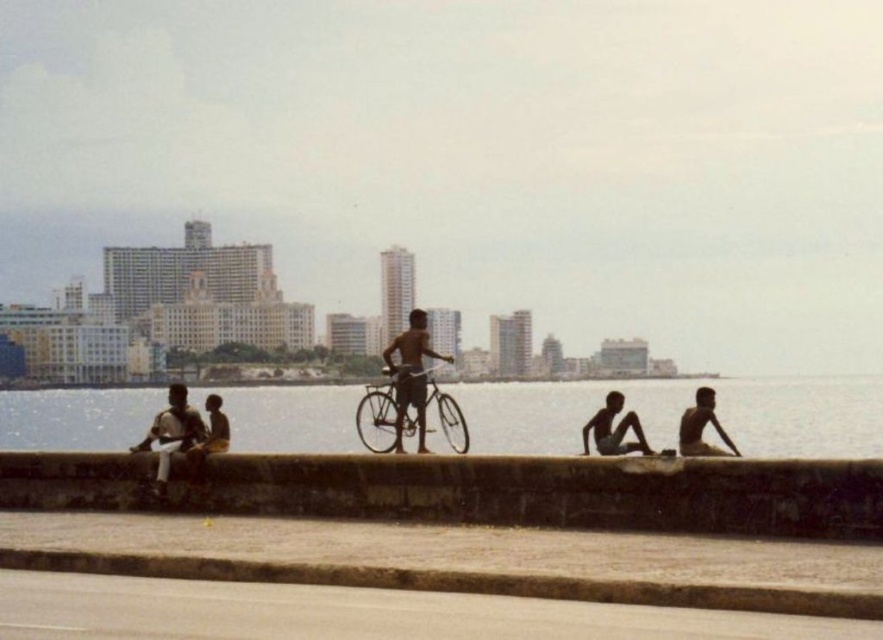
Is brown concrete curb at lower center taller than silver metallic bicycle at center?

No, brown concrete curb at lower center is not taller than silver metallic bicycle at center.

Between brown concrete curb at lower center and silver metallic bicycle at center, which one has less height?

With less height is brown concrete curb at lower center.

Where is `brown concrete curb at lower center`? brown concrete curb at lower center is located at coordinates (455, 580).

At what (x,y) coordinates should I click in order to perform the action: click on brown concrete curb at lower center. Please return your answer as a coordinate pair (x, y). The width and height of the screenshot is (883, 640). Looking at the image, I should click on (455, 580).

Find the location of a particular element. The width and height of the screenshot is (883, 640). smooth concrete ledge at center is located at coordinates (477, 490).

Between smooth concrete ledge at center and shiny metallic bicycle at center, which one is positioned lower?

smooth concrete ledge at center is below.

The image size is (883, 640). I want to click on smooth concrete ledge at center, so click(477, 490).

Measure the distance between smooth concrete ledge at center and camera.

smooth concrete ledge at center and camera are 13.44 meters apart.

Between point (783, 497) and point (395, 397), which one is positioned in front?

Positioned in front is point (783, 497).

Between point (413, 465) and point (380, 452), which one is positioned in front?

Point (413, 465)

Locate an element on the screen. Image resolution: width=883 pixels, height=640 pixels. smooth concrete ledge at center is located at coordinates (477, 490).